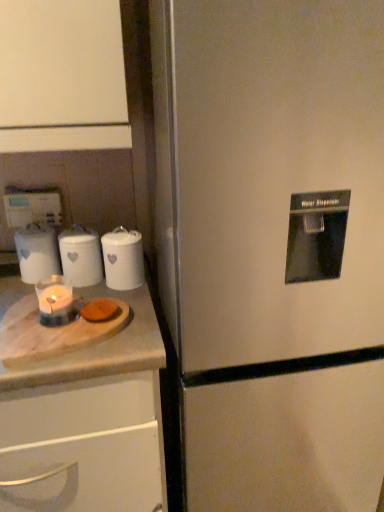
Locate an element on the screen. white marble tray at left is located at coordinates (77, 339).

You are a GUI agent. You are given a task and a screenshot of the screen. Output one action in this format:
    pyautogui.click(x=<x>, y=<y>)
    Task: Click on the brown matte cookie at lower left
    This screenshot has height=512, width=384.
    Given the screenshot: What is the action you would take?
    pyautogui.click(x=100, y=310)

What do you see at coordinates (89, 421) in the screenshot? The image size is (384, 512). I see `white marble cutting board at left` at bounding box center [89, 421].

Image resolution: width=384 pixels, height=512 pixels. What do you see at coordinates (273, 247) in the screenshot?
I see `satin silver refrigerator at center` at bounding box center [273, 247].

Describe the element at coordinates (37, 252) in the screenshot. I see `white glossy candle at left` at that location.

This screenshot has width=384, height=512. What do you see at coordinates (123, 259) in the screenshot?
I see `white glossy canister at upper left, placed as the second kitchen appliance when sorted from left to right` at bounding box center [123, 259].

What are the coordinates of `white marble tray at left` in the screenshot? It's located at (77, 339).

How many degrees apart are the facing directions of translucent glass candle at lower left and brown matte cookie at lower left?

translucent glass candle at lower left and brown matte cookie at lower left are facing 0.00255 degrees away from each other.

Considering the positions of objects translucent glass candle at lower left and brown matte cookie at lower left in the image provided, who is in front, translucent glass candle at lower left or brown matte cookie at lower left?

translucent glass candle at lower left is more forward.

Is translucent glass candle at lower left aimed at brown matte cookie at lower left?

No, translucent glass candle at lower left is not oriented towards brown matte cookie at lower left.

From their relative heights in the image, would you say translucent glass candle at lower left is taller or shorter than brown matte cookie at lower left?

Considering their sizes, translucent glass candle at lower left has more height than brown matte cookie at lower left.

From the image's perspective, does translucent glass candle at lower left appear lower than white marble tray at left?

Incorrect, from the image's perspective, translucent glass candle at lower left is higher than white marble tray at left.

Can you confirm if translucent glass candle at lower left is taller than white marble tray at left?

Indeed, translucent glass candle at lower left has a greater height compared to white marble tray at left.

Visually, is translucent glass candle at lower left positioned to the left or to the right of white marble tray at left?

From the image, it's evident that translucent glass candle at lower left is to the right of white marble tray at left.

Is point (75, 313) closer or farther from the camera than point (52, 335)?

Point (75, 313) is positioned farther from the camera compared to point (52, 335).

Between white marble tray at left and white marble cutting board at left, which one has smaller width?

Thinner between the two is white marble tray at left.

Is white marble tray at left aimed at white marble cutting board at left?

No, white marble tray at left is not oriented towards white marble cutting board at left.

Does point (63, 369) appear closer or farther from the camera than point (16, 399)?

Point (63, 369) is positioned closer to the camera compared to point (16, 399).

Which object is closer to the camera, white ceramic canisters at left, the 1th kitchen appliance in the left-to-right sequence, or white marble cutting board at left?

white marble cutting board at left is more forward.

From the image's perspective, between white ceramic canisters at left, the 1th kitchen appliance in the left-to-right sequence, and white marble cutting board at left, who is located below?

A: From the image's view, white marble cutting board at left is below.

Between white ceramic canisters at left, the 1th kitchen appliance in the left-to-right sequence, and white marble cutting board at left, which one has more height?

Standing taller between the two is white marble cutting board at left.

Could you measure the distance between white ceramic canisters at left, the second kitchen appliance viewed from the right, and white marble cutting board at left?

They are 34.88 centimeters apart.

Is translucent glass candle at lower left spatially inside white glossy canister at upper left, positioned as the 1th kitchen appliance in right-to-left order, or outside of it?

translucent glass candle at lower left cannot be found inside white glossy canister at upper left, positioned as the 1th kitchen appliance in right-to-left order.

Does translucent glass candle at lower left have a greater width compared to white glossy canister at upper left, positioned as the 1th kitchen appliance in right-to-left order?

Incorrect, the width of translucent glass candle at lower left does not surpass that of white glossy canister at upper left, positioned as the 1th kitchen appliance in right-to-left order.

Between translucent glass candle at lower left and white glossy canister at upper left, positioned as the 1th kitchen appliance in right-to-left order, which one has smaller size?

translucent glass candle at lower left is smaller.

From a real-world perspective, relative to white glossy canister at upper left, positioned as the 1th kitchen appliance in right-to-left order, is translucent glass candle at lower left vertically above or below?

From a real-world perspective, translucent glass candle at lower left is physically below white glossy canister at upper left, positioned as the 1th kitchen appliance in right-to-left order.

Can you confirm if white ceramic canisters at left, the 1th kitchen appliance in the left-to-right sequence, is wider than white marble tray at left?

No.

Relative to white marble tray at left, is white ceramic canisters at left, the second kitchen appliance viewed from the right, in front or behind?

Clearly, white ceramic canisters at left, the second kitchen appliance viewed from the right, is behind white marble tray at left.

From a real-world perspective, is white ceramic canisters at left, the second kitchen appliance viewed from the right, physically located above or below white marble tray at left?

In terms of real-world spatial position, white ceramic canisters at left, the second kitchen appliance viewed from the right, is above white marble tray at left.

Looking at this image, from the image's perspective, which object appears higher, white ceramic canisters at left, the second kitchen appliance viewed from the right, or white marble tray at left?

From the image's view, white ceramic canisters at left, the second kitchen appliance viewed from the right, is above.

Which is farther, [241,292] or [55,404]?

The point [55,404] is farther.

Is satin silver refrigerator at center bigger than white marble cutting board at left?

Yes.

Is satin silver refrigerator at center at the left side of white marble cutting board at left?

No, satin silver refrigerator at center is not to the left of white marble cutting board at left.

Is satin silver refrigerator at center positioned with its back to white marble cutting board at left?

No, white marble cutting board at left is not at the back of satin silver refrigerator at center.

Image resolution: width=384 pixels, height=512 pixels. In order to click on candle holder above the brown matte cookie at lower left (from the image's perspective) in this screenshot , I will do `click(55, 301)`.

Image resolution: width=384 pixels, height=512 pixels. I want to click on candle holder to the right of white marble tray at left, so click(55, 301).

From the image, which object appears to be farther from white marble tray at left, satin silver refrigerator at center or white glossy canister at upper left, placed as the second kitchen appliance when sorted from left to right?

The object further to white marble tray at left is satin silver refrigerator at center.

Estimate the real-world distances between objects in this image. Which object is further from white ceramic canisters at left, the second kitchen appliance viewed from the right, white marble cutting board at left or translucent glass candle at lower left?

white marble cutting board at left lies further to white ceramic canisters at left, the second kitchen appliance viewed from the right, than the other object.

When comparing their distances from white ceramic canisters at left, the 1th kitchen appliance in the left-to-right sequence, does brown matte cookie at lower left or white glossy canister at upper left, placed as the second kitchen appliance when sorted from left to right, seem further?

brown matte cookie at lower left is further to white ceramic canisters at left, the 1th kitchen appliance in the left-to-right sequence.

Which object lies further to the anchor point white marble cutting board at left, white ceramic canisters at left, the 1th kitchen appliance in the left-to-right sequence, or satin silver refrigerator at center?

white ceramic canisters at left, the 1th kitchen appliance in the left-to-right sequence.

From the image, which object appears to be nearer to translucent glass candle at lower left, white glossy candle at left or white glossy canister at upper left, placed as the second kitchen appliance when sorted from left to right?

white glossy candle at left is closer to translucent glass candle at lower left.

Which object lies further to the anchor point translucent glass candle at lower left, white marble tray at left or satin silver refrigerator at center?

satin silver refrigerator at center lies further to translucent glass candle at lower left than the other object.

Considering their positions, is white marble tray at left positioned closer to white ceramic canisters at left, the 1th kitchen appliance in the left-to-right sequence, than translucent glass candle at lower left?

The object closer to white ceramic canisters at left, the 1th kitchen appliance in the left-to-right sequence, is translucent glass candle at lower left.

Considering their positions, is white ceramic canisters at left, the 1th kitchen appliance in the left-to-right sequence, positioned closer to translucent glass candle at lower left than satin silver refrigerator at center?

Among the two, white ceramic canisters at left, the 1th kitchen appliance in the left-to-right sequence, is located nearer to translucent glass candle at lower left.

I want to click on countertop that lies between white glossy candle at left and white marble cutting board at left from top to bottom, so click(x=77, y=339).

Identify the location of kitchen appliance between brown matte cookie at lower left and white ceramic canisters at left, the second kitchen appliance viewed from the right, in the front-back direction. (123, 259).

At what (x,y) coordinates should I click in order to perform the action: click on food that lies between translucent glass candle at lower left and white marble cutting board at left from top to bottom. Please return your answer as a coordinate pair (x, y). The width and height of the screenshot is (384, 512). Looking at the image, I should click on (100, 310).

Where is `countertop between white glossy canister at upper left, placed as the second kitchen appliance when sorted from left to right, and white marble cutting board at left in the up-down direction`? countertop between white glossy canister at upper left, placed as the second kitchen appliance when sorted from left to right, and white marble cutting board at left in the up-down direction is located at coordinates (77, 339).